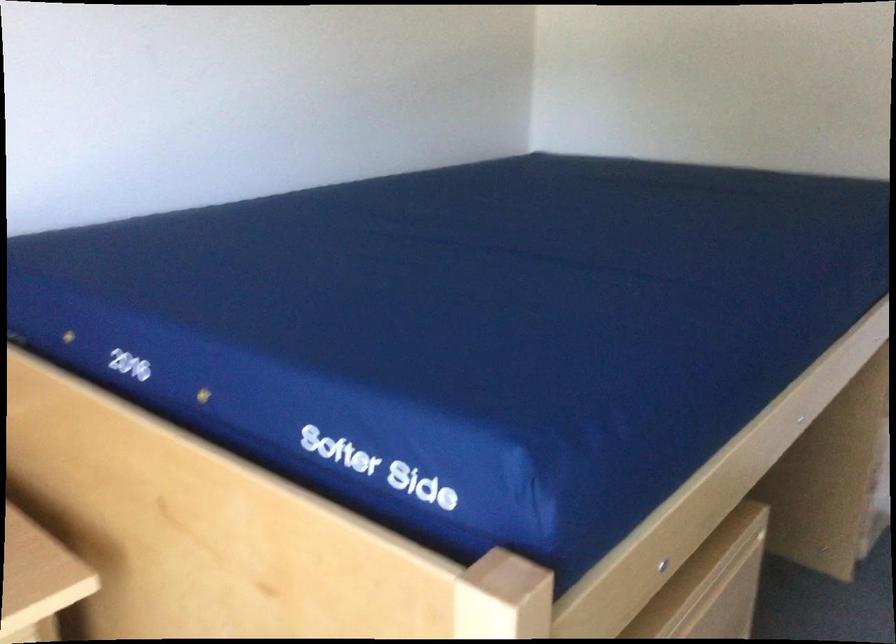
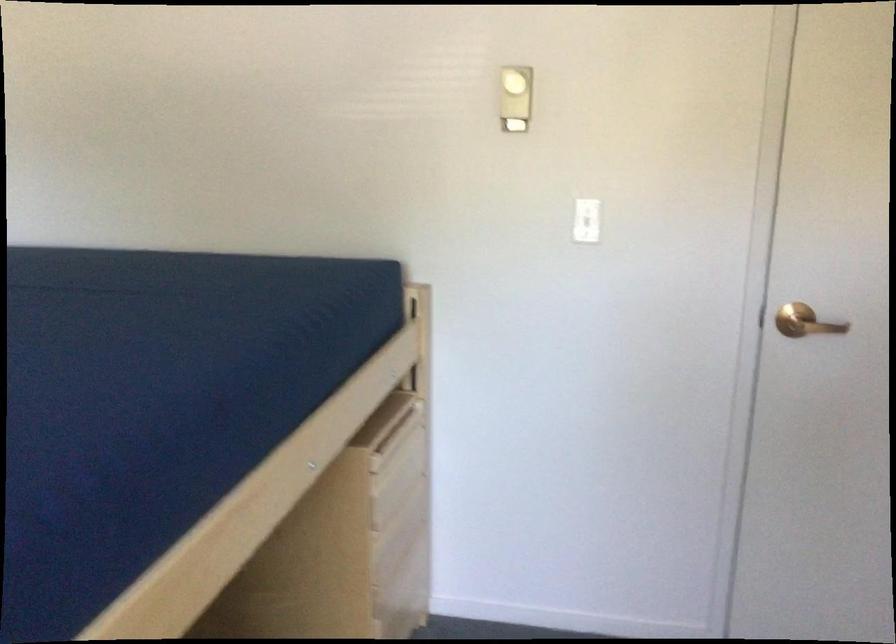
Question: Based on the continuous images, in which direction is the camera rotating? Reply with the corresponding letter.

Choices:
 (A) Left
 (B) Right
 (C) Up
 (D) Down

Answer: (B)